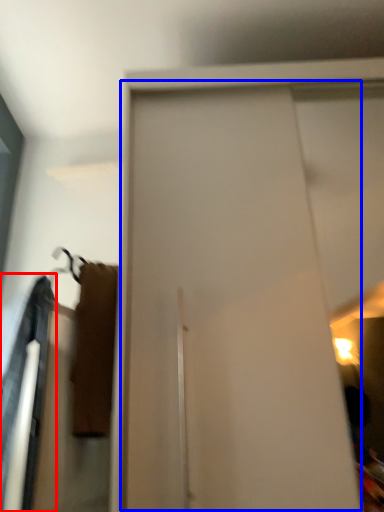
Question: Among these objects, which one is nearest to the camera, robe (highlighted by a red box) or screen door (highlighted by a blue box)?

Choices:
 (A) robe
 (B) screen door

Answer: (B)